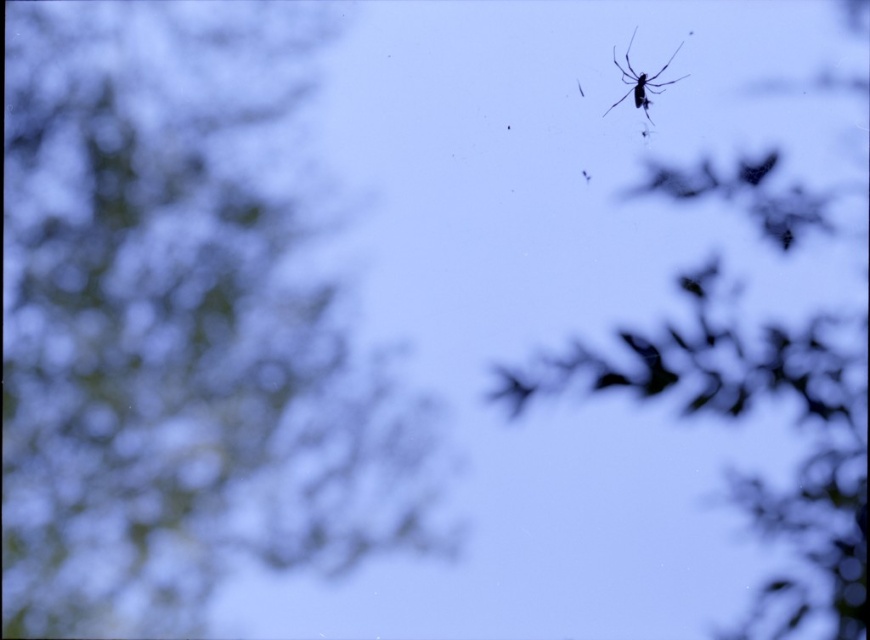
Question: Which is farther from the green matte tree at upper left?

Choices:
 (A) transparent silk spider at upper right
 (B) silvery metallic branch at upper right

Answer: (A)

Question: Does green matte tree at upper left appear under silvery metallic branch at upper right?

Choices:
 (A) no
 (B) yes

Answer: (A)

Question: Is the position of silvery metallic branch at upper right more distant than that of transparent silk spider at upper right?

Choices:
 (A) no
 (B) yes

Answer: (A)

Question: Can you confirm if green matte tree at upper left is positioned below transparent silk spider at upper right?

Choices:
 (A) no
 (B) yes

Answer: (B)

Question: Which object is positioned closest to the green matte tree at upper left?

Choices:
 (A) silvery metallic branch at upper right
 (B) transparent silk spider at upper right

Answer: (A)

Question: Which point is farther from the camera taking this photo?

Choices:
 (A) pos(632,196)
 (B) pos(291,22)
 (C) pos(621,70)

Answer: (C)